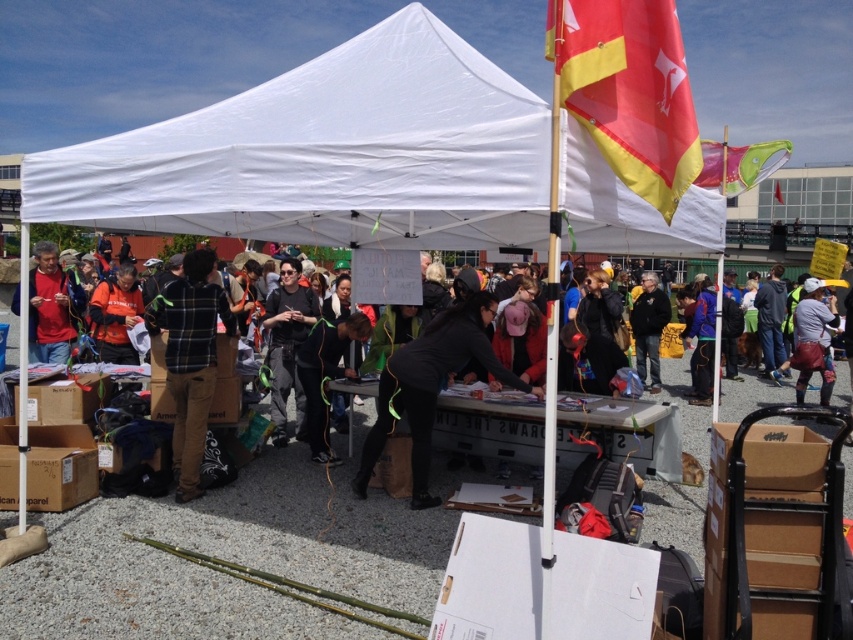
Between red/yellow fabric flag at upper right and green fabric kite at upper right, which one is positioned lower?

red/yellow fabric flag at upper right

Does point (639, 38) lie in front of point (740, 173)?

Yes, point (639, 38) is closer to viewer.

Where is `red/yellow fabric flag at upper right`? The width and height of the screenshot is (853, 640). red/yellow fabric flag at upper right is located at coordinates (628, 90).

Which is more to the left, orange fabric shirt at center or leather bag at right?

orange fabric shirt at center is more to the left.

In the scene shown: Is orange fabric shirt at center wider than leather bag at right?

No, orange fabric shirt at center is not wider than leather bag at right.

Which is behind, point (112, 332) or point (805, 326)?

The point (805, 326) is behind.

Where is `orange fabric shirt at center`? orange fabric shirt at center is located at coordinates (115, 316).

Between point (641, 36) and point (294, 385), which one is positioned behind?

The point (294, 385) is behind.

Who is more forward, [630,10] or [296,269]?

Point [630,10] is more forward.

Where is `red/yellow fabric flag at upper right`? red/yellow fabric flag at upper right is located at coordinates (628, 90).